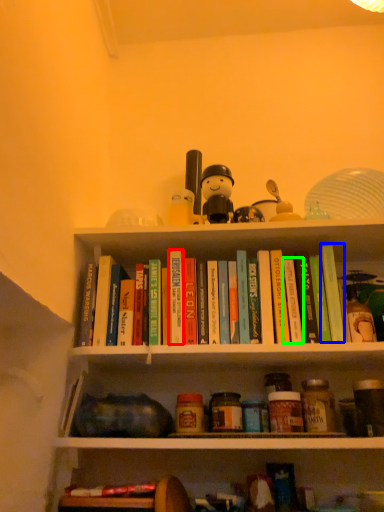
Question: Considering the real-world distances, which object is farthest from paperback book (highlighted by a red box)? paperback book (highlighted by a blue box) or paperback book (highlighted by a green box)?

Choices:
 (A) paperback book
 (B) paperback book

Answer: (A)